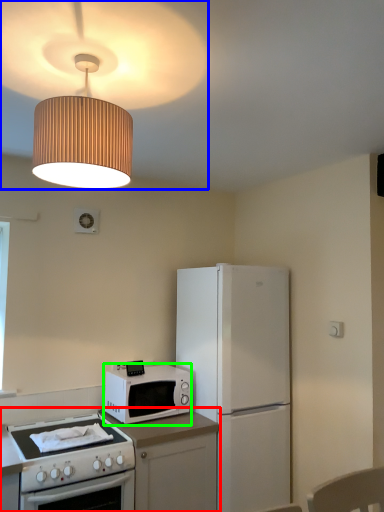
Question: Which is farther away from countertop (highlighted by a red box)? lamp (highlighted by a blue box) or microwave oven (highlighted by a green box)?

Choices:
 (A) lamp
 (B) microwave oven

Answer: (A)